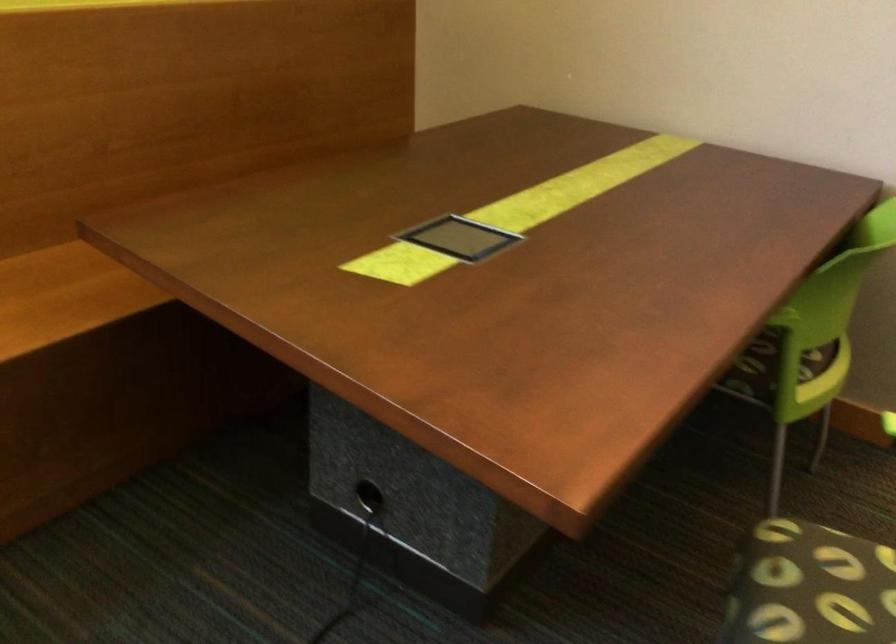
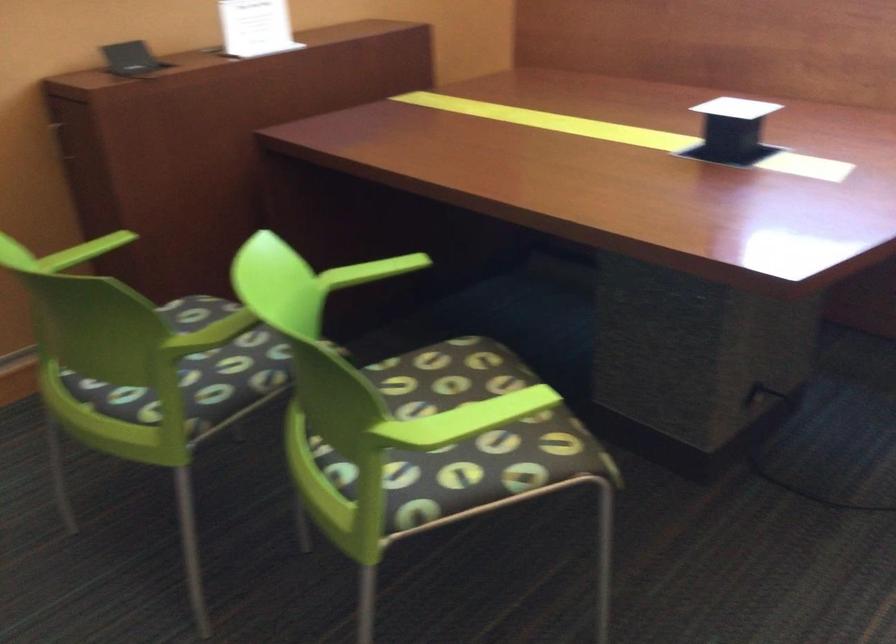
First-person continuous shooting, in which direction is the camera rotating?

The camera rotated toward left-down.